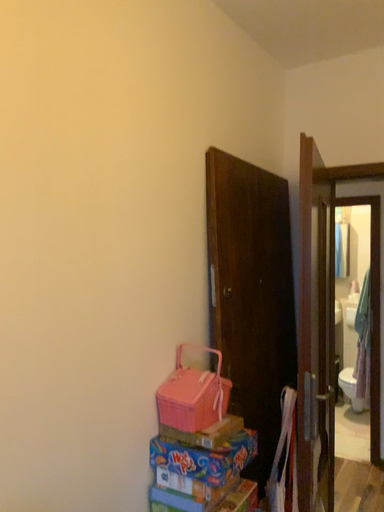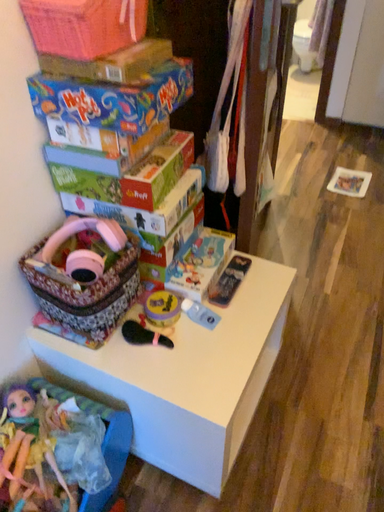
Question: Which way did the camera rotate in the video?

Choices:
 (A) rotated downward
 (B) rotated upward

Answer: (A)